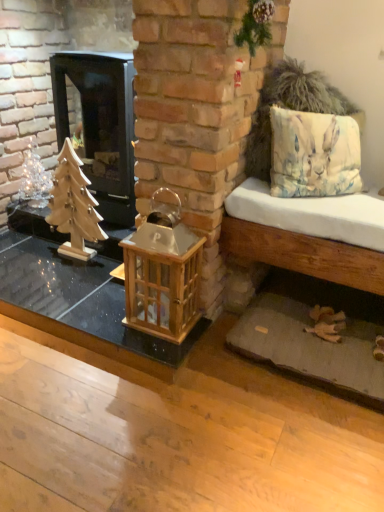
Where is `space that is in front of wooden christmas tree at left`? The width and height of the screenshot is (384, 512). space that is in front of wooden christmas tree at left is located at coordinates (68, 278).